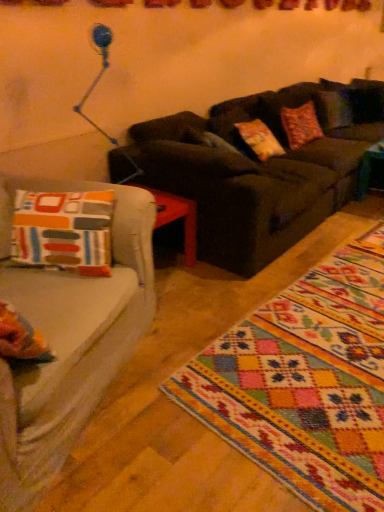
Question: Do you think dark brown leather couch at center is within multicolored woven rug at lower right, or outside of it?

Choices:
 (A) inside
 (B) outside

Answer: (B)

Question: Relative to multicolored woven rug at lower right, is dark brown leather couch at center in front or behind?

Choices:
 (A) behind
 (B) front

Answer: (A)

Question: From the image's perspective, is dark brown leather couch at center located above or below multicolored woven rug at lower right?

Choices:
 (A) above
 (B) below

Answer: (A)

Question: Is multicolored woven rug at lower right to the left or to the right of dark brown leather couch at center in the image?

Choices:
 (A) right
 (B) left

Answer: (A)

Question: Do you think multicolored woven rug at lower right is within dark brown leather couch at center, or outside of it?

Choices:
 (A) outside
 (B) inside

Answer: (A)

Question: From the image's perspective, is multicolored woven rug at lower right positioned above or below dark brown leather couch at center?

Choices:
 (A) above
 (B) below

Answer: (B)

Question: Considering the positions of point (357, 385) and point (286, 238), is point (357, 385) closer or farther from the camera than point (286, 238)?

Choices:
 (A) farther
 (B) closer

Answer: (B)